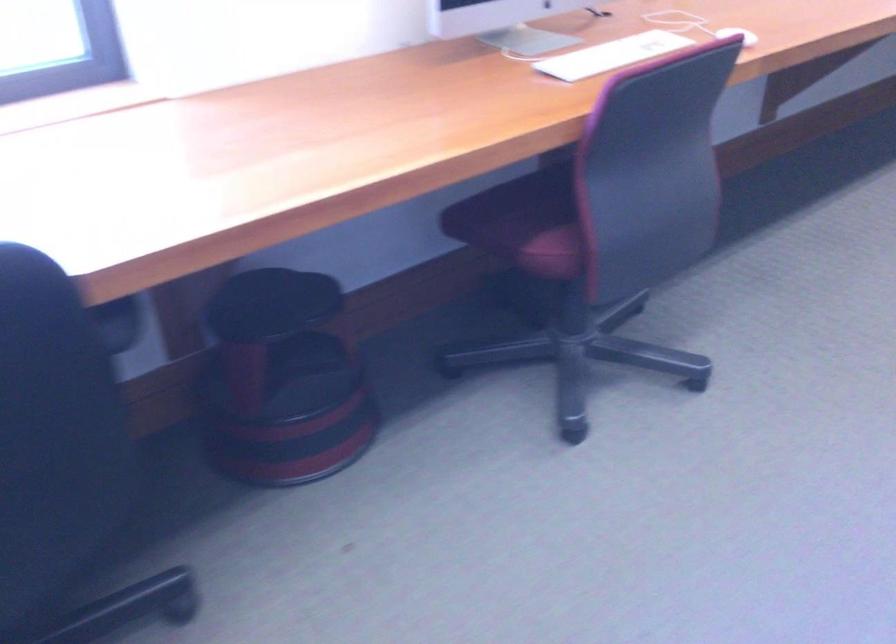
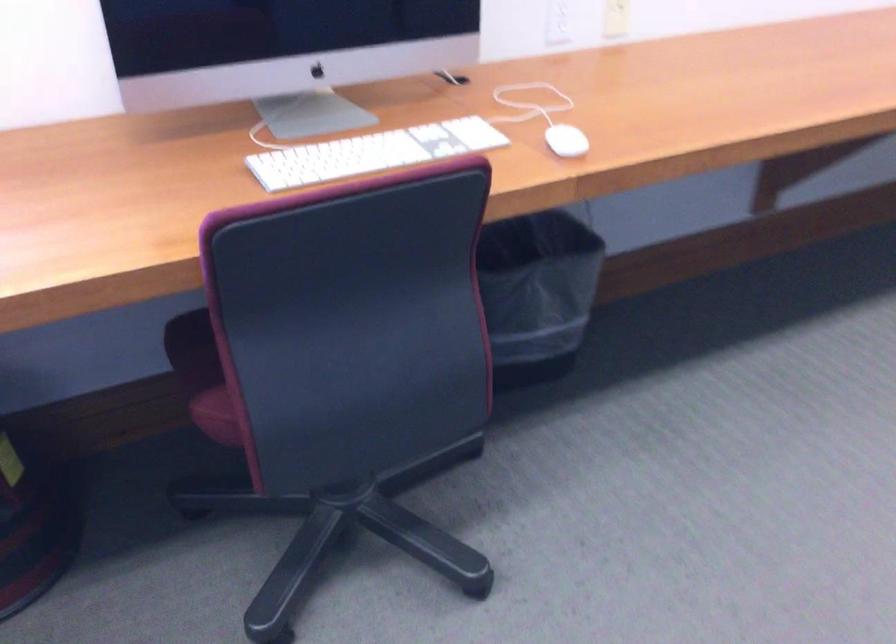
Question: The images are taken continuously from a first-person perspective. In which direction is your viewpoint rotating?

Choices:
 (A) Left
 (B) Right
 (C) Up
 (D) Down

Answer: (A)